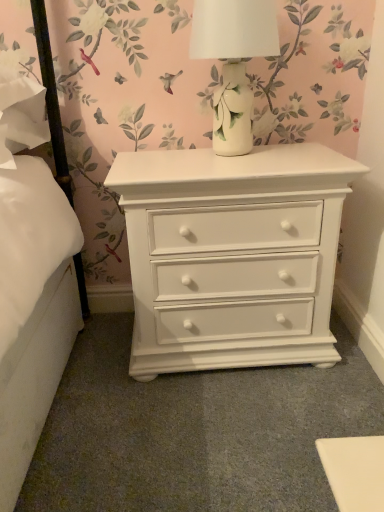
In order to click on vacant space in front of white ceramic vase at upper center in this screenshot , I will do `click(244, 168)`.